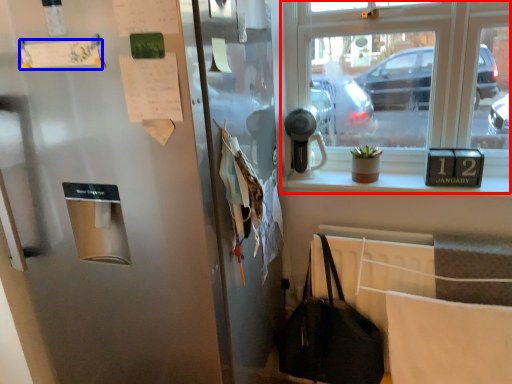
Question: Among these objects, which one is nearest to the camera, window (highlighted by a red box) or paper (highlighted by a blue box)?

Choices:
 (A) window
 (B) paper

Answer: (B)